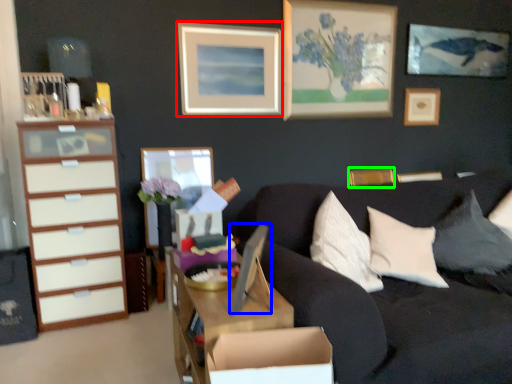
Question: Estimate the real-world distances between objects in this image. Which object is farther from picture frame (highlighted by a red box), picture frame (highlighted by a blue box) or picture frame (highlighted by a green box)?

Choices:
 (A) picture frame
 (B) picture frame

Answer: (A)